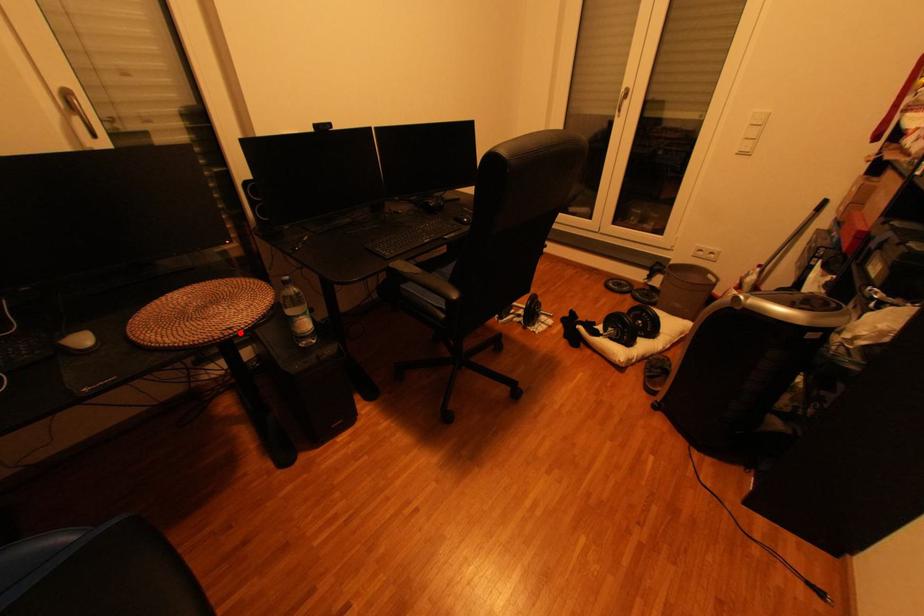
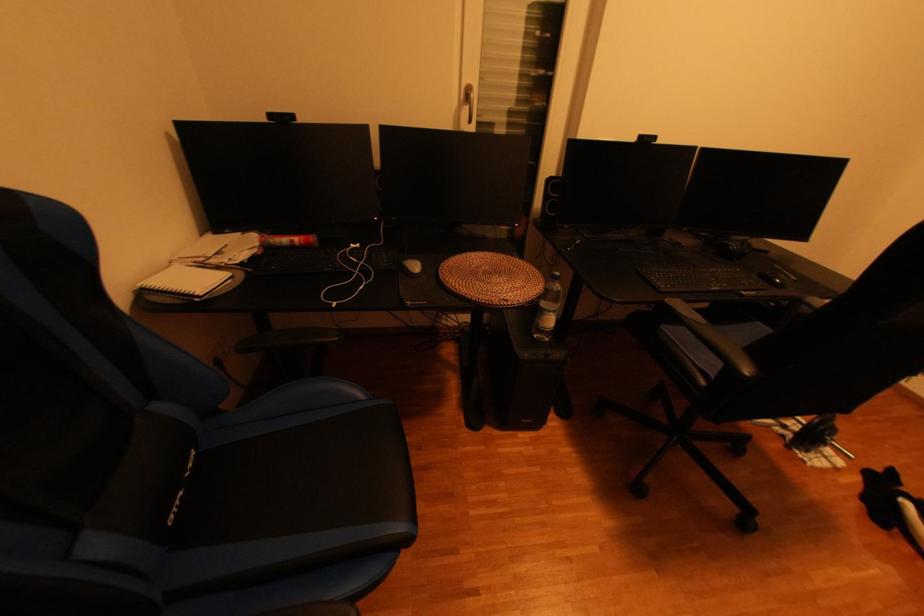
Find the pixel in the second image that matches the highlighted location in the first image.

(515, 304)